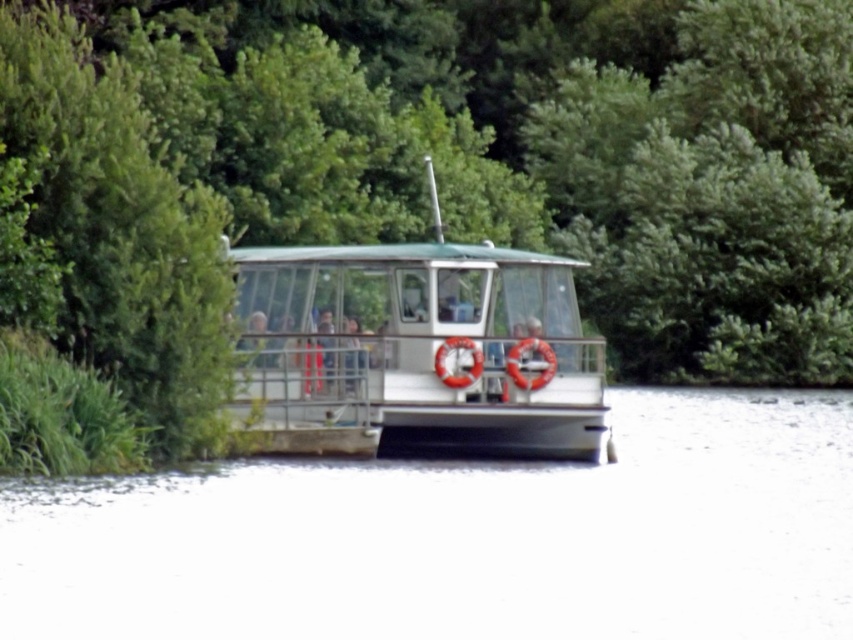
Does point (805, 157) come in front of point (138, 561)?

No, it is behind (138, 561).

Which of these two, green leafy tree at center or white smooth water at center, stands taller?

Standing taller between the two is green leafy tree at center.

Which is in front, point (244, 145) or point (402, 529)?

Point (402, 529) is more forward.

The width and height of the screenshot is (853, 640). Find the location of `green leafy tree at center`. green leafy tree at center is located at coordinates (554, 150).

Is green leafy tree at center taller than white glossy boat at center?

Correct, green leafy tree at center is much taller as white glossy boat at center.

Measure the distance between point (456, 205) and camera.

They are 46.74 meters apart.

Where is `green leafy tree at center`? This screenshot has height=640, width=853. green leafy tree at center is located at coordinates (554, 150).

Which is below, white smooth water at center or white glossy boat at center?

Positioned lower is white smooth water at center.

In the scene shown: Which of these two, white smooth water at center or white glossy boat at center, stands shorter?

With less height is white smooth water at center.

Where is `white smooth water at center`? This screenshot has height=640, width=853. white smooth water at center is located at coordinates (463, 538).